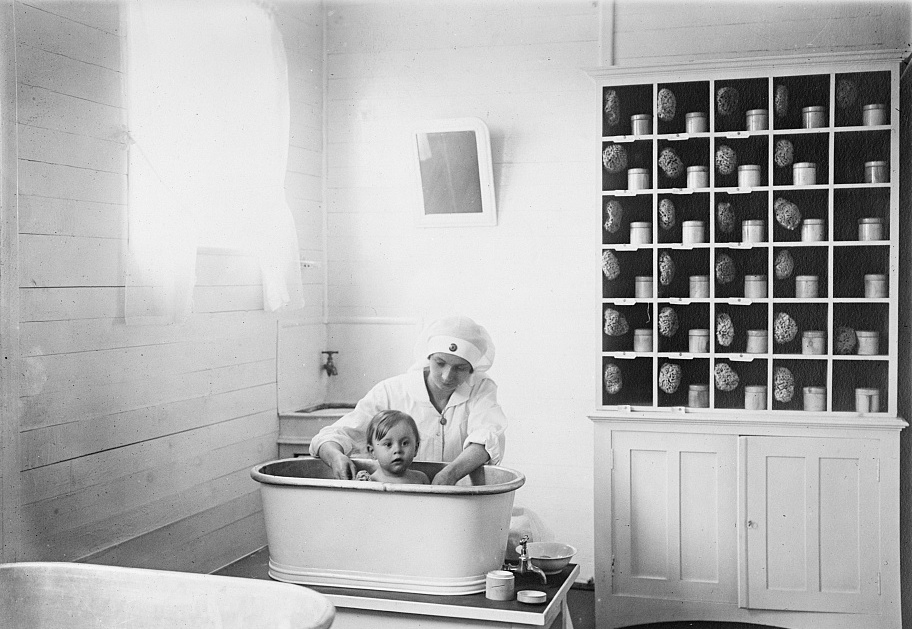
Where is `faucet`? The height and width of the screenshot is (629, 912). faucet is located at coordinates (329, 358).